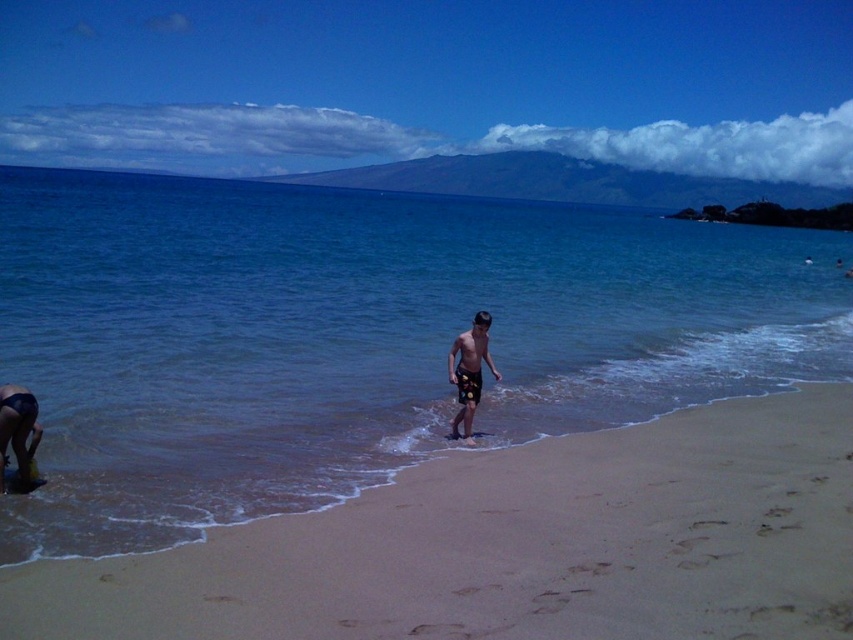
You are standing on the beach and want to reach the clear blue water at center. Based on your current position, which direction should you move to get there?

To reach the clear blue water at center, you should move towards the center of the beach since that is where the clear blue water is located according to the coordinates provided.

What are the coordinates of the sandy beach at center in the image?

The coordinates of the sandy beach at center are at point (515, 545).